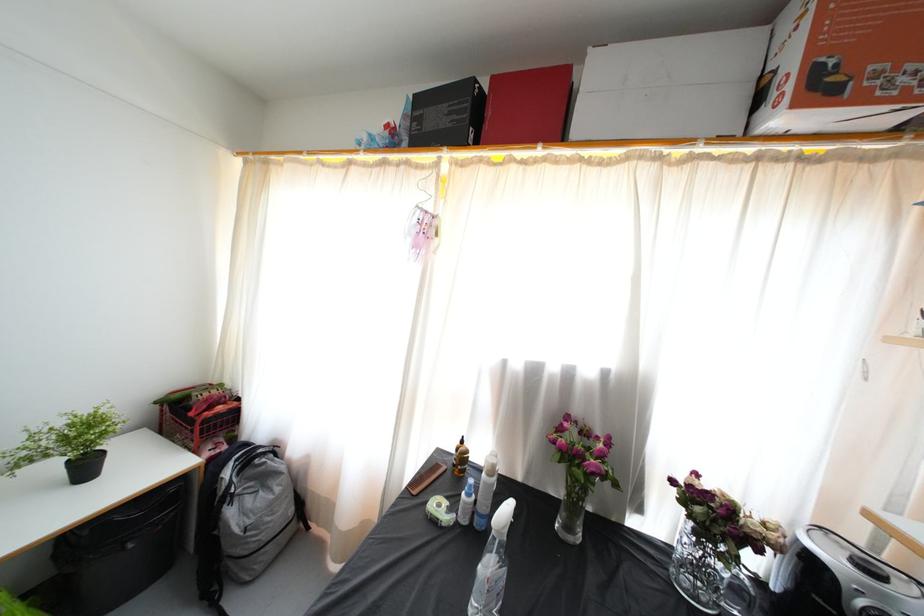
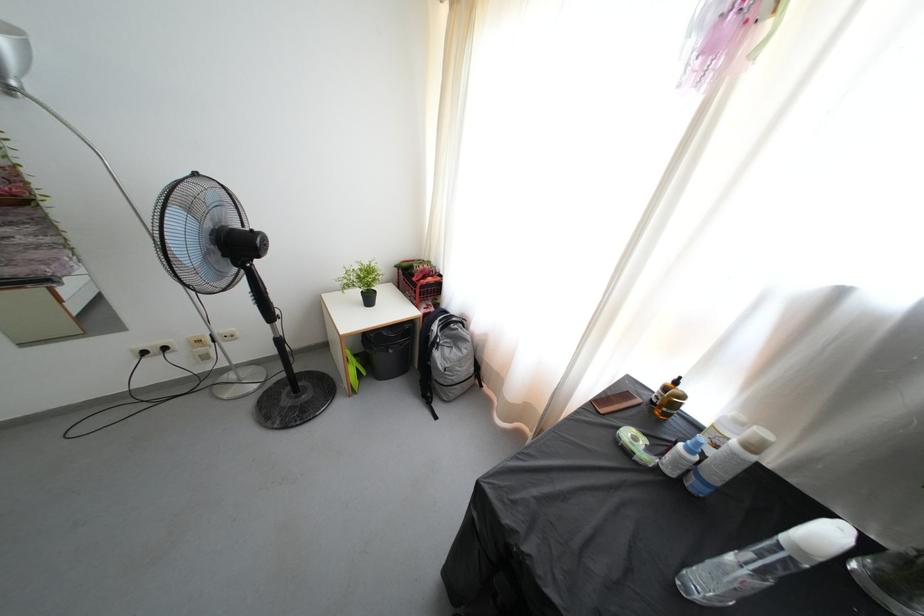
In the second image, find the point that corresponds to point (244, 557) in the first image.

(445, 387)